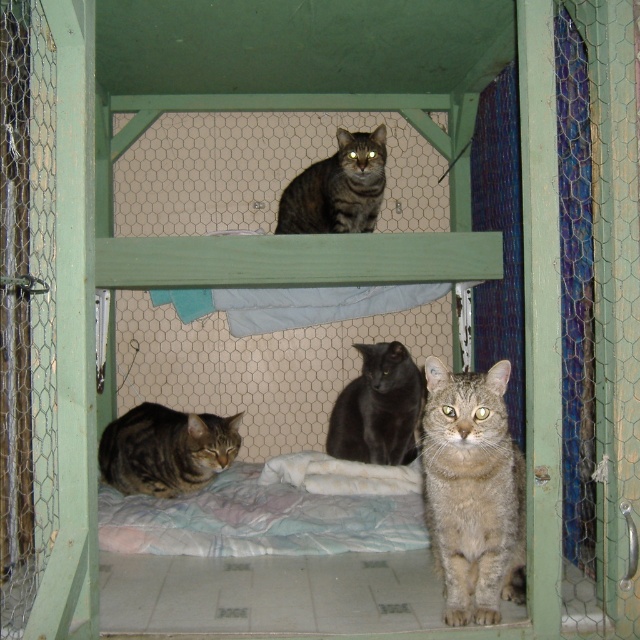
You are standing at the point marked as point (492, 582) in the cat shelter. You want to approach the cats but need to stay at least 6 feet away from them to avoid stressing them. Are you within the safe distance?

The distance between you and the viewer is 5.06 feet, which is less than the required 6 feet. Therefore, you are too close to the cats and should move back to maintain the safe distance.

You are a visitor at a pet shelter and want to pet the tabby fur cat at lower left and the black glossy cat at center. Which cat should you approach first to reach the closest one?

You should approach the tabby fur cat at lower left first because it is closer to the viewer than the black glossy cat at center.

You are a cat owner visiting the shelter and want to adopt a cat. You notice the black glossy cat at center and the tabby fur cat at upper center. Which cat is taller?

The black glossy cat at center is taller than the tabby fur cat at upper center.